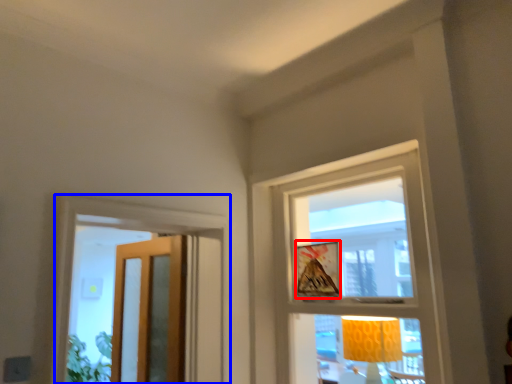
Question: Which object is further to the camera taking this photo, picture frame (highlighted by a red box) or window (highlighted by a blue box)?

Choices:
 (A) picture frame
 (B) window

Answer: (A)